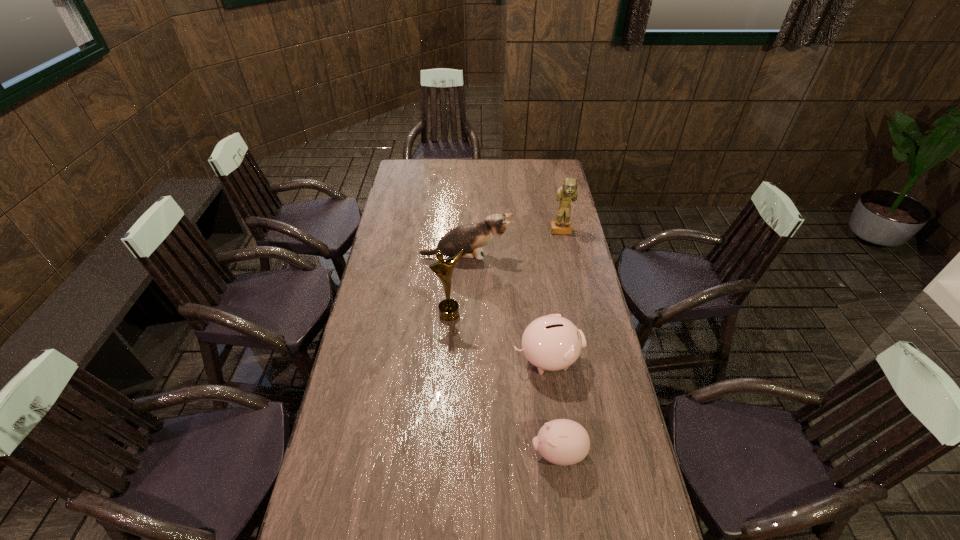
I want to click on free location located at the face of the second farthest object, so click(x=527, y=256).

Image resolution: width=960 pixels, height=540 pixels. I want to click on vacant space located 0.320m on the front of the taller piggy bank, so click(x=563, y=481).

What are the coordinates of `free spot located 0.240m at the snout of the shorter piggy bank` in the screenshot? It's located at (449, 453).

Find the location of a particular element. This screenshot has height=540, width=960. free location located at the snout of the shorter piggy bank is located at coordinates click(x=449, y=453).

Where is `vacant space located 0.120m at the snout of the shorter piggy bank`? The image size is (960, 540). vacant space located 0.120m at the snout of the shorter piggy bank is located at coordinates (491, 453).

Where is `figurine located at the right edge`? The image size is (960, 540). figurine located at the right edge is located at coordinates (568, 191).

Where is `vacant area at the far edge`? This screenshot has height=540, width=960. vacant area at the far edge is located at coordinates (523, 170).

Where is `blank space at the left edge`? This screenshot has height=540, width=960. blank space at the left edge is located at coordinates (405, 211).

At what (x,y) coordinates should I click in order to perform the action: click on vacant space at the right edge. Please return your answer as a coordinate pair (x, y). The width and height of the screenshot is (960, 540). Looking at the image, I should click on (584, 311).

I want to click on vacant space at the far left corner, so click(x=400, y=176).